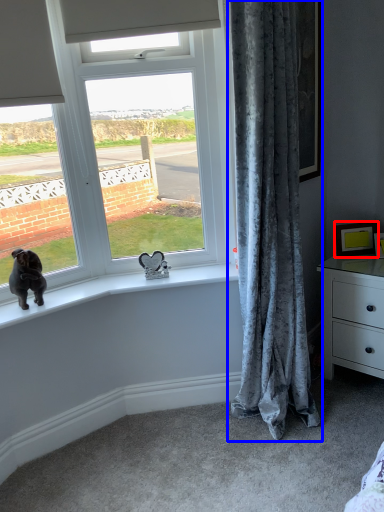
Question: Among these objects, which one is farthest to the camera, picture frame (highlighted by a red box) or curtain (highlighted by a blue box)?

Choices:
 (A) picture frame
 (B) curtain

Answer: (A)